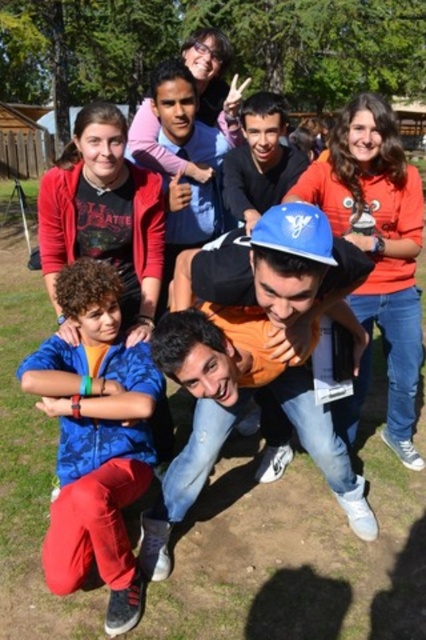
Image resolution: width=426 pixels, height=640 pixels. Find the location of `blue hard hat at center`. blue hard hat at center is located at coordinates tap(250, 374).